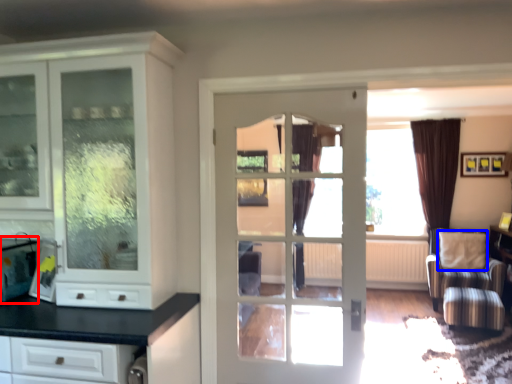
Question: Which object is further to the camera taking this photo, appliance (highlighted by a red box) or pillow (highlighted by a blue box)?

Choices:
 (A) appliance
 (B) pillow

Answer: (B)